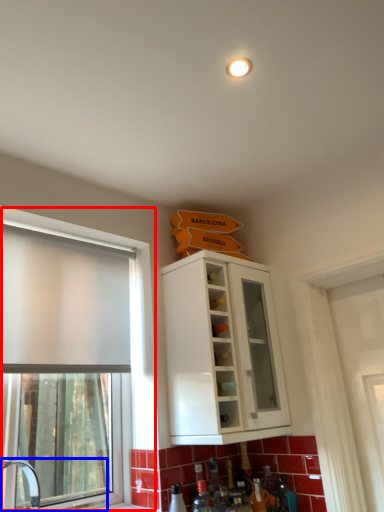
Question: Which of the following is the farthest to the observer, window (highlighted by a red box) or sink (highlighted by a blue box)?

Choices:
 (A) window
 (B) sink

Answer: (A)